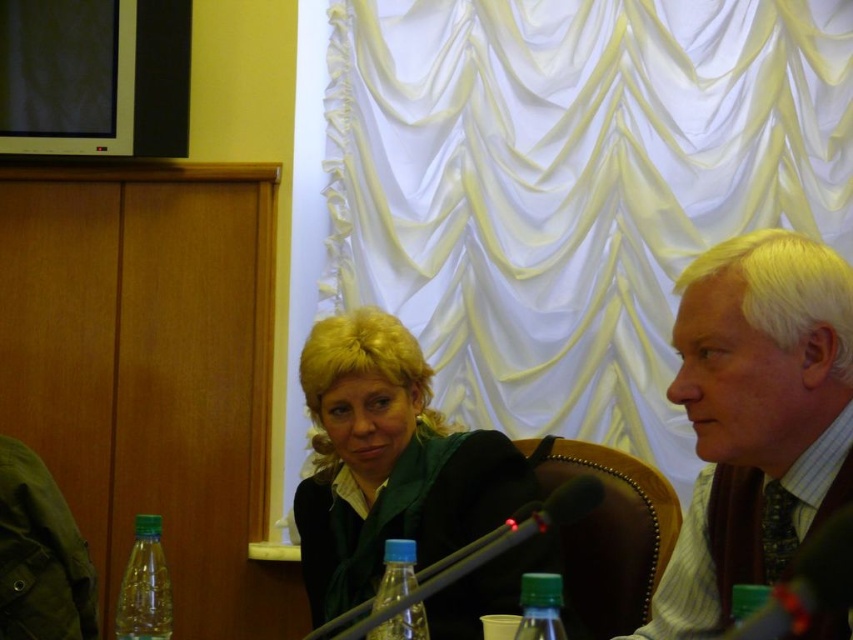
Between matte black monitor at upper left and green plastic bottle at lower left, which one has more height?

With more height is matte black monitor at upper left.

Is point (64, 56) positioned before point (140, 580)?

That is False.

At what (x,y) coordinates should I click in order to perform the action: click on matte black monitor at upper left. Please return your answer as a coordinate pair (x, y). Looking at the image, I should click on (94, 77).

Can you confirm if matte green scarf at center is taller than blue plastic bottle at center?

Correct, matte green scarf at center is much taller as blue plastic bottle at center.

Who is higher up, matte green scarf at center or blue plastic bottle at center?

matte green scarf at center is above.

Which is in front, point (396, 492) or point (375, 595)?

Positioned in front is point (375, 595).

What are the coordinates of `matte green scarf at center` in the screenshot? It's located at (387, 461).

Can you confirm if white striped shirt at center is positioned to the left of matte green scarf at center?

In fact, white striped shirt at center is to the right of matte green scarf at center.

Can you confirm if white striped shirt at center is shorter than matte green scarf at center?

Indeed, white striped shirt at center has a lesser height compared to matte green scarf at center.

Describe the element at coordinates (756, 417) in the screenshot. I see `white striped shirt at center` at that location.

At what (x,y) coordinates should I click in order to perform the action: click on white striped shirt at center. Please return your answer as a coordinate pair (x, y). This screenshot has width=853, height=640. Looking at the image, I should click on (756, 417).